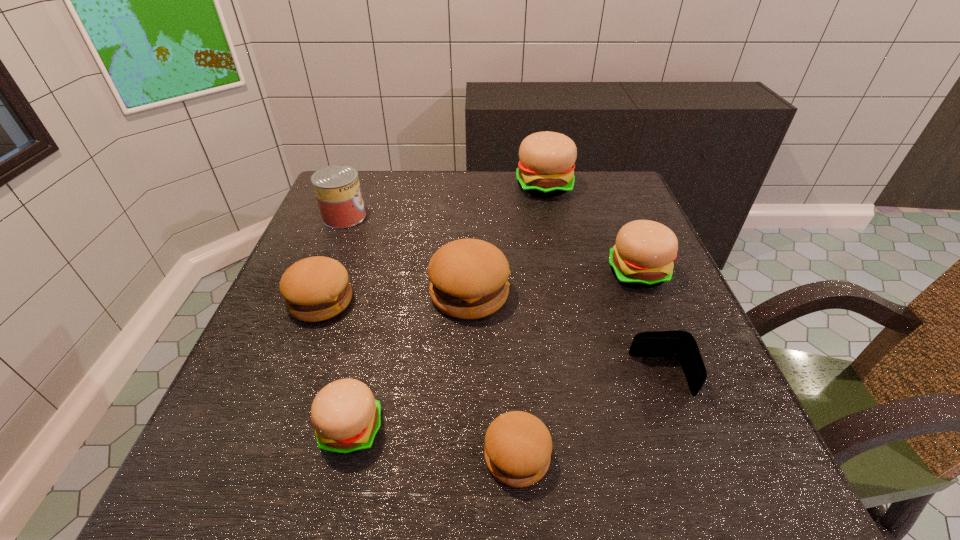
In order to click on vacant point at the far edge in this screenshot , I will do `click(428, 183)`.

Image resolution: width=960 pixels, height=540 pixels. In order to click on vacant space at the left edge of the desktop in this screenshot , I will do pos(342,321).

Find the location of a particular element. free region at the right edge is located at coordinates (672, 285).

The height and width of the screenshot is (540, 960). Find the location of `vacant region at the far left corner of the desktop`. vacant region at the far left corner of the desktop is located at coordinates (380, 212).

The image size is (960, 540). In order to click on free point at the far right corner in this screenshot , I will do `click(582, 173)`.

In the image, there is a desktop. Where is `vacant space at the near right corner`? vacant space at the near right corner is located at coordinates (754, 450).

You are a GUI agent. You are given a task and a screenshot of the screen. Output one action in this format:
    pyautogui.click(x=<x>, y=<y>)
    Task: Click on the free space between the leftmost hamburger and the wallet
    
    Given the screenshot: What is the action you would take?
    491,339

Locate an element on the screen. The image size is (960, 540). free space between the rightmost beige hamburger and the fifth hamburger from right to left is located at coordinates (494, 351).

Locate an element on the screen. This screenshot has height=540, width=960. free point between the can and the smallest brown hamburger is located at coordinates (431, 336).

Find the location of a particular element. This screenshot has width=960, height=540. free space that is in between the second smallest brown hamburger and the biggest brown hamburger is located at coordinates (396, 298).